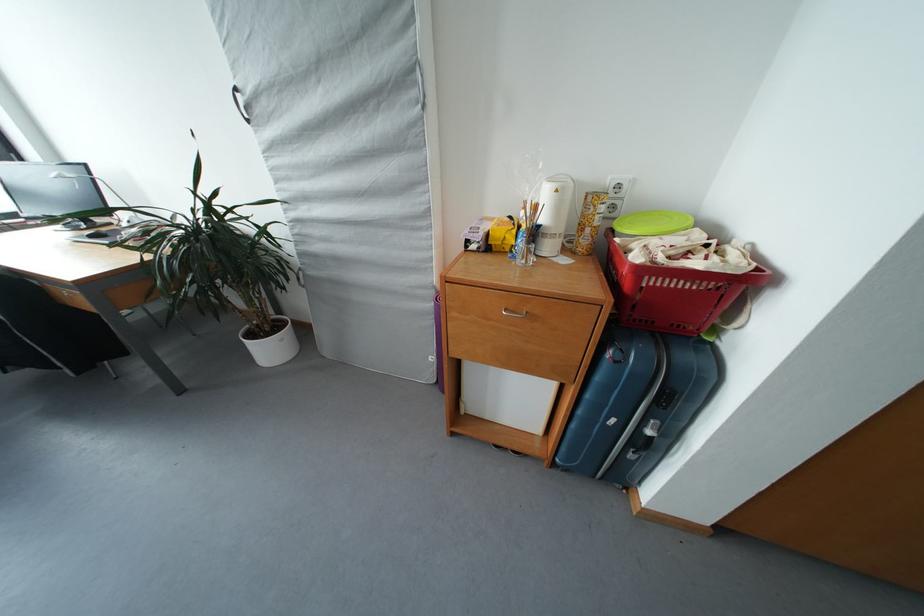
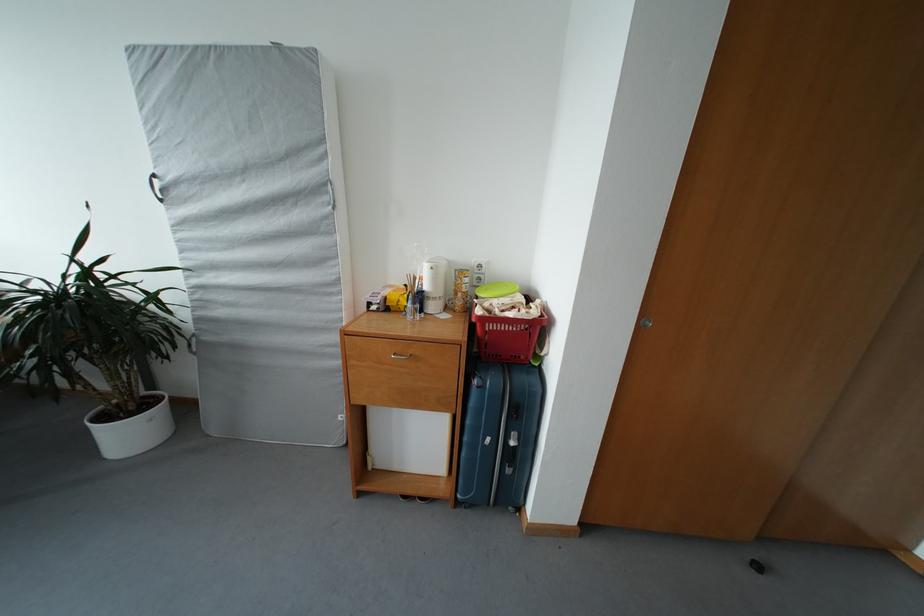
Question: The camera is either moving clockwise (left) or counter-clockwise (right) around the object. The first image is from the beginning of the video and the second image is from the end. Is the camera moving left or right when shooting the video?

Choices:
 (A) Left
 (B) Right

Answer: (A)